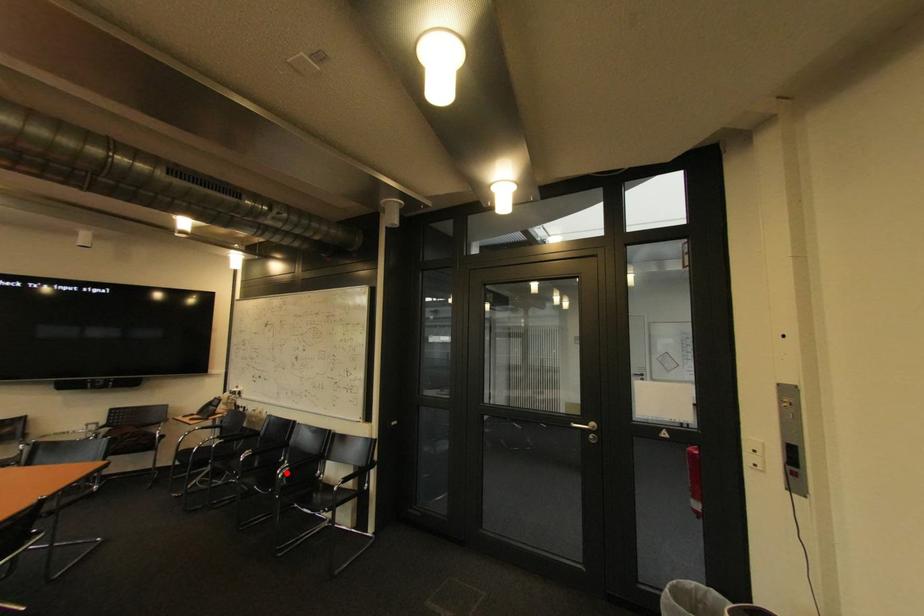
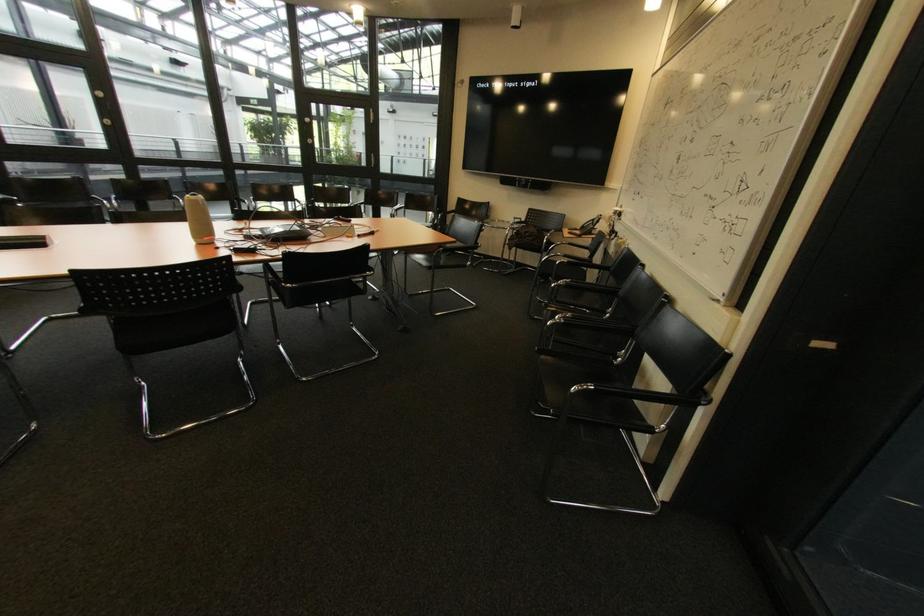
Question: I am providing you with two images of the same scene from different viewpoints. In image1, a red point is highlighted. Considering the same 3D point in image2, which of the following is correct?

Choices:
 (A) It is closer
 (B) It is farther

Answer: (A)